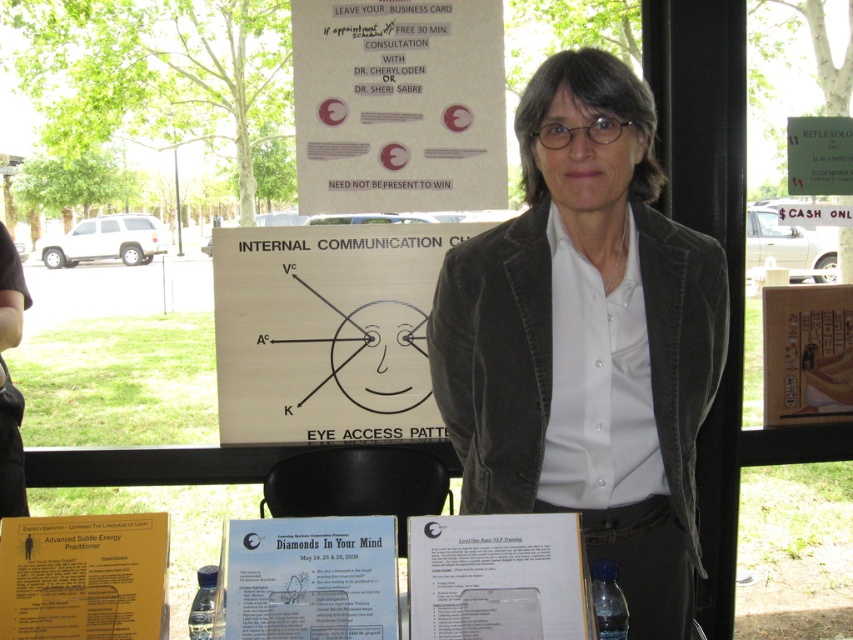
Question: Does white paper sign at upper center have a greater width compared to white paper poster at center?

Choices:
 (A) no
 (B) yes

Answer: (B)

Question: Estimate the real-world distances between objects in this image. Which object is farther from the white paper poster at upper right?

Choices:
 (A) yellow paper at lower left
 (B) white paper poster at center

Answer: (A)

Question: Can you confirm if white paper sign at upper center is wider than white paper at center?

Choices:
 (A) no
 (B) yes

Answer: (B)

Question: Does matte black jacket at center appear on the left side of wooden sign at center?

Choices:
 (A) yes
 (B) no

Answer: (A)

Question: Based on their relative distances, which object is farther from the white paper poster at center?

Choices:
 (A) matte black jacket at center
 (B) white paper sign at upper center
 (C) wooden sign at center
 (D) white paper poster at upper right

Answer: (D)

Question: Which point appears closest to the camera in this image?

Choices:
 (A) (659, 192)
 (B) (28, 572)

Answer: (B)